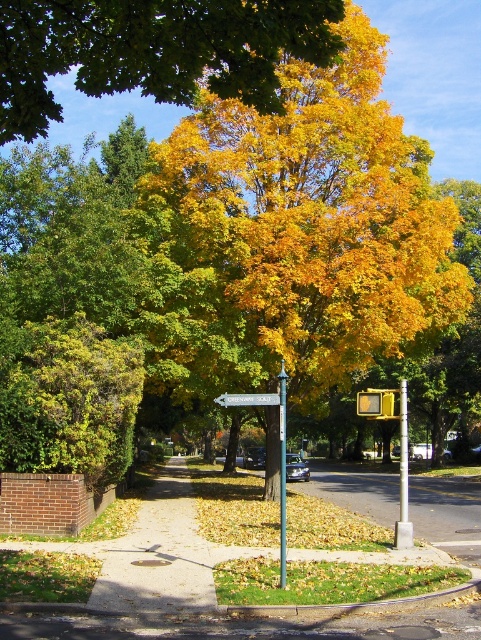
You are a delivery robot with a 2.5 meter wide package. You need to navigate through the space between the golden yellow leaves at upper center and the white plastic signpost at center. Can you fit through the space between them?

The golden yellow leaves at upper center and the white plastic signpost at center are 4.66 meters apart from each other. Since the package is 2.5 meters wide, the robot can fit through the space between them as the distance is greater than the package width.

You are standing at the street corner and want to find the green street signpost. According to the image, where is the green street signpost located relative to the point marked at coordinates point (x=151, y=51)?

The point (x=151, y=51) is on golden yellow leaves at upper center, so the green street signpost is located near the sidewalk, which is in front of the tree and away from the leaves at upper center.